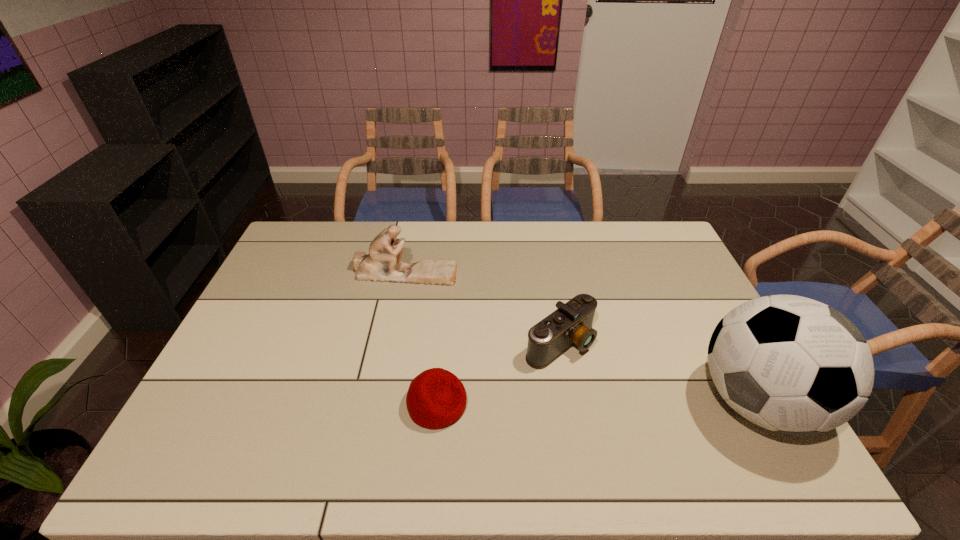
Find the location of a particular element. free space at the right edge is located at coordinates [x=664, y=268].

I want to click on vacant space at the far left corner of the desktop, so click(326, 244).

Image resolution: width=960 pixels, height=540 pixels. Identify the location of vacant space at the near left corner of the desktop. (215, 401).

Locate an element on the screen. unoccupied area between the figurine and the shortest object is located at coordinates (420, 339).

In order to click on blank region between the shortest object and the soccer ball in this screenshot , I will do `click(597, 403)`.

Find the location of `blank region between the third object from left to right and the soccer ball`. blank region between the third object from left to right and the soccer ball is located at coordinates (x=659, y=372).

The image size is (960, 540). What are the coordinates of `free space that is in between the beanbag and the second tallest object` in the screenshot? It's located at (420, 339).

Locate an element on the screen. free space between the figurine and the third tallest object is located at coordinates (482, 308).

Find the location of a particular element. Image resolution: width=960 pixels, height=540 pixels. vacant region between the second object from right to left and the figurine is located at coordinates (482, 308).

Find the location of a particular element. The height and width of the screenshot is (540, 960). blank region between the beanbag and the soccer ball is located at coordinates (597, 403).